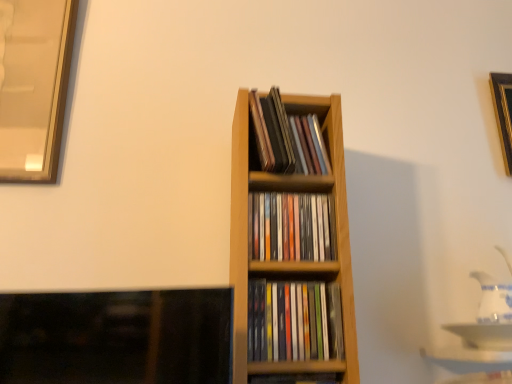
Question: Can you confirm if wooden cd case at center, which appears as the 3th book when ordered from the bottom, is shorter than multicolored plastic cds at center, which appears as the second book when ordered from the bottom?

Choices:
 (A) no
 (B) yes

Answer: (A)

Question: From a real-world perspective, is wooden cd case at center, which appears as the 3th book when ordered from the bottom, under multicolored plastic cds at center, which appears as the second book when ordered from the bottom?

Choices:
 (A) no
 (B) yes

Answer: (A)

Question: Considering the relative sizes of wooden cd case at center, which appears as the 3th book when ordered from the bottom, and multicolored plastic cds at center, the third book viewed from the top, in the image provided, is wooden cd case at center, which appears as the 3th book when ordered from the bottom, bigger than multicolored plastic cds at center, the third book viewed from the top,?

Choices:
 (A) no
 (B) yes

Answer: (A)

Question: Is wooden cd case at center, which appears as the 3th book when ordered from the bottom, next to multicolored plastic cds at center, which appears as the second book when ordered from the bottom, and touching it?

Choices:
 (A) no
 (B) yes

Answer: (A)

Question: From the image's perspective, is wooden cd case at center, which appears as the 3th book when ordered from the bottom, over multicolored plastic cds at center, the third book viewed from the top?

Choices:
 (A) no
 (B) yes

Answer: (B)

Question: Can you confirm if wooden cd case at center, the 2th book when ordered from top to bottom, is thinner than multicolored plastic cds at center, which appears as the second book when ordered from the bottom?

Choices:
 (A) yes
 (B) no

Answer: (A)

Question: Is multicolored plastic cds at center, the third book viewed from the top, positioned in front of wooden cd case at center, which appears as the 3th book when ordered from the bottom?

Choices:
 (A) yes
 (B) no

Answer: (A)

Question: Is wooden cd case at center, which appears as the 3th book when ordered from the bottom, at the back of multicolored plastic cds at center, which appears as the second book when ordered from the bottom?

Choices:
 (A) no
 (B) yes

Answer: (A)

Question: Does multicolored plastic cds at center, the third book viewed from the top, contain wooden cd case at center, the 2th book when ordered from top to bottom?

Choices:
 (A) yes
 (B) no

Answer: (B)

Question: Is multicolored plastic cds at center, which appears as the second book when ordered from the bottom, not near wooden cd case at center, which appears as the 3th book when ordered from the bottom?

Choices:
 (A) no
 (B) yes

Answer: (A)

Question: Can you confirm if multicolored plastic cds at center, which appears as the second book when ordered from the bottom, is wider than wooden cd case at center, which appears as the 3th book when ordered from the bottom?

Choices:
 (A) no
 (B) yes

Answer: (B)

Question: Is multicolored plastic cds at center, which appears as the second book when ordered from the bottom, facing towards wooden cd case at center, the 2th book when ordered from top to bottom?

Choices:
 (A) no
 (B) yes

Answer: (A)

Question: From a real-world perspective, is wooden cd case at center, which appears as the 3th book when ordered from the bottom, on gold metallic picture frame at upper right?

Choices:
 (A) yes
 (B) no

Answer: (B)